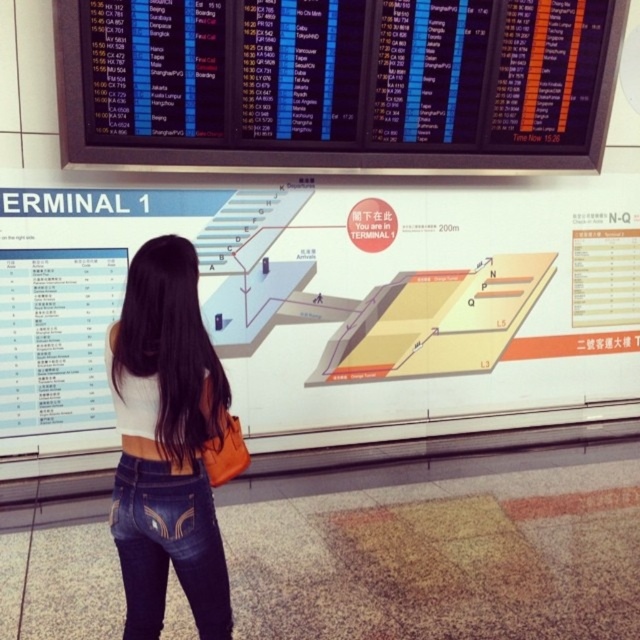
Question: Which object appears closest to the camera in this image?

Choices:
 (A) denim at center
 (B) white matte tank top at center
 (C) white glossy map at upper center
 (D) black plastic flight information display at upper center

Answer: (B)

Question: From the image, what is the correct spatial relationship of white glossy map at upper center in relation to denim at center?

Choices:
 (A) right
 (B) left

Answer: (A)

Question: Estimate the real-world distances between objects in this image. Which object is closer to the white matte tank top at center?

Choices:
 (A) black plastic flight information display at upper center
 (B) denim at center

Answer: (B)

Question: Is white glossy map at upper center positioned behind white matte tank top at center?

Choices:
 (A) yes
 (B) no

Answer: (A)

Question: Can you confirm if white glossy map at upper center is positioned below white matte tank top at center?

Choices:
 (A) yes
 (B) no

Answer: (B)

Question: Which object is closer to the camera taking this photo?

Choices:
 (A) denim at center
 (B) white glossy map at upper center
 (C) black plastic flight information display at upper center
 (D) white matte tank top at center

Answer: (D)